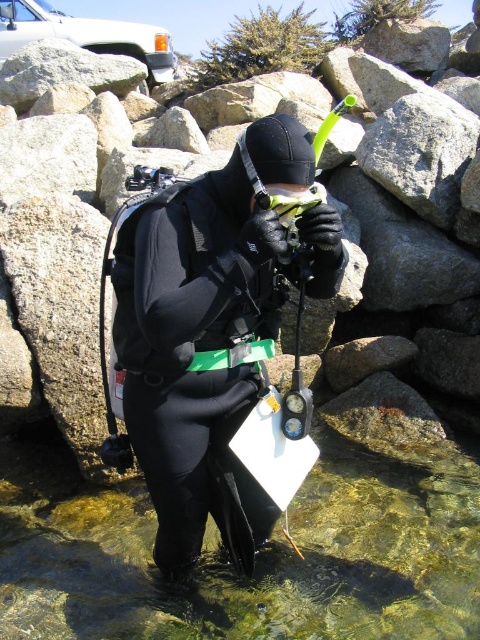
Image resolution: width=480 pixels, height=640 pixels. What do you see at coordinates (116, 307) in the screenshot?
I see `black matte scuba tank at center` at bounding box center [116, 307].

Does black matte scuba tank at center have a lesser height compared to matte black goggles at center?

Incorrect, black matte scuba tank at center's height does not fall short of matte black goggles at center's.

Is point (142, 196) more distant than point (316, 198)?

Yes.

Where is `black matte scuba tank at center`? black matte scuba tank at center is located at coordinates (116, 307).

Is clear water at lower center positioned in front of black matte wetsuit at center?

No, it is behind black matte wetsuit at center.

Which is more to the right, clear water at lower center or black matte wetsuit at center?

Positioned to the right is black matte wetsuit at center.

Where is `clear water at lower center`? clear water at lower center is located at coordinates (229, 566).

Where is `clear water at lower center`? This screenshot has width=480, height=640. clear water at lower center is located at coordinates (229, 566).

The image size is (480, 640). What are the coordinates of `black matte wetsuit at center` in the screenshot? It's located at (213, 330).